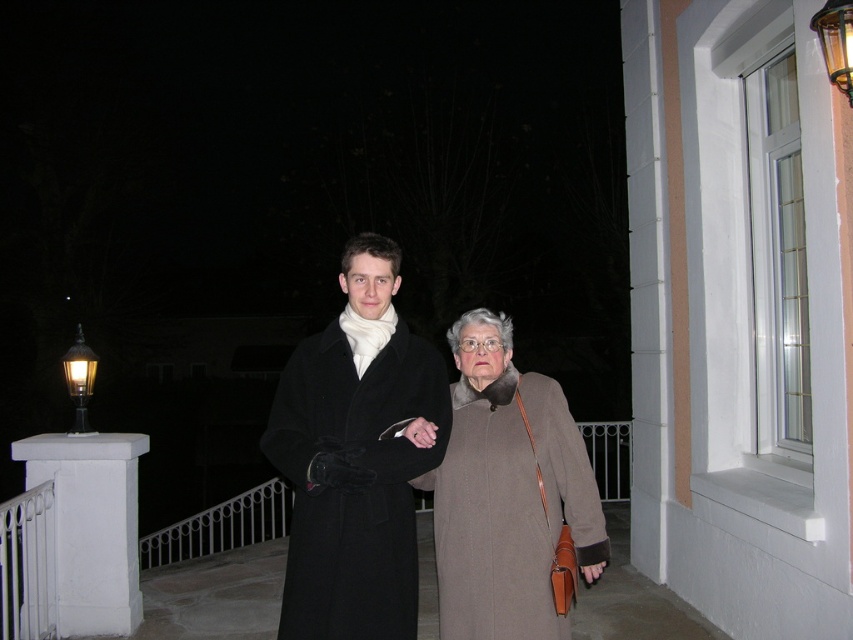
You are a delivery person trying to place a small package on a surface. You see the white concrete porch at lower left and the matte black coat at center. Which surface can accommodate the package?

The white concrete porch at lower left has a smaller size compared to matte black coat at center, so the matte black coat at center is larger and can accommodate the package.

Where is the brown wool coat at center located in the image?

The brown wool coat at center is located at point (508, 493) in the image.